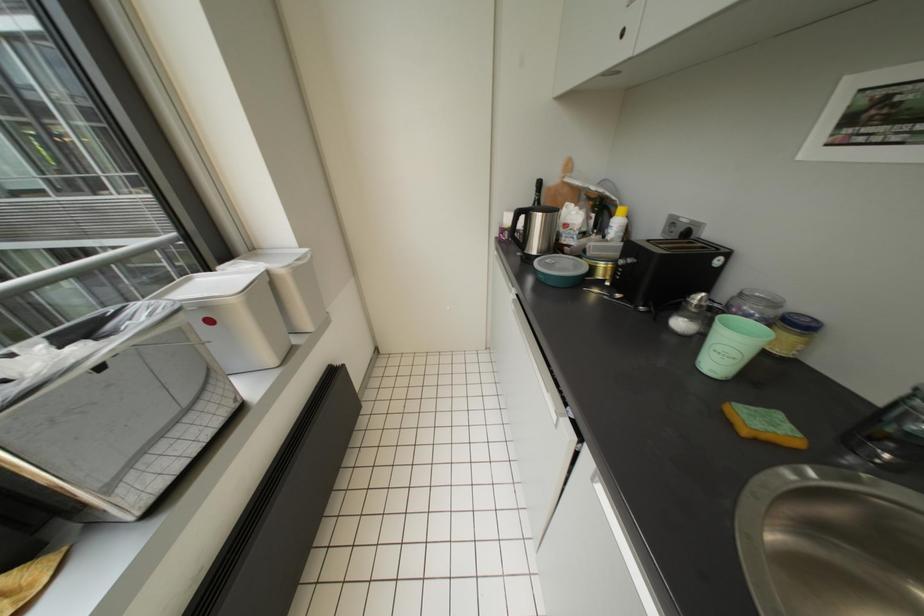
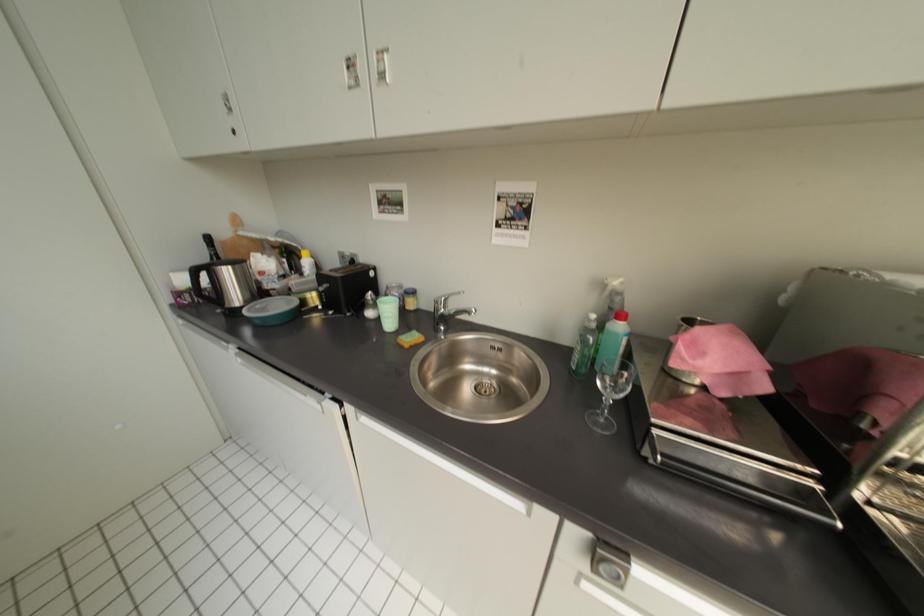
Question: Based on the continuous images, in which direction is the camera rotating? Reply with the corresponding letter.

Choices:
 (A) Left
 (B) Right
 (C) Up
 (D) Down

Answer: (B)